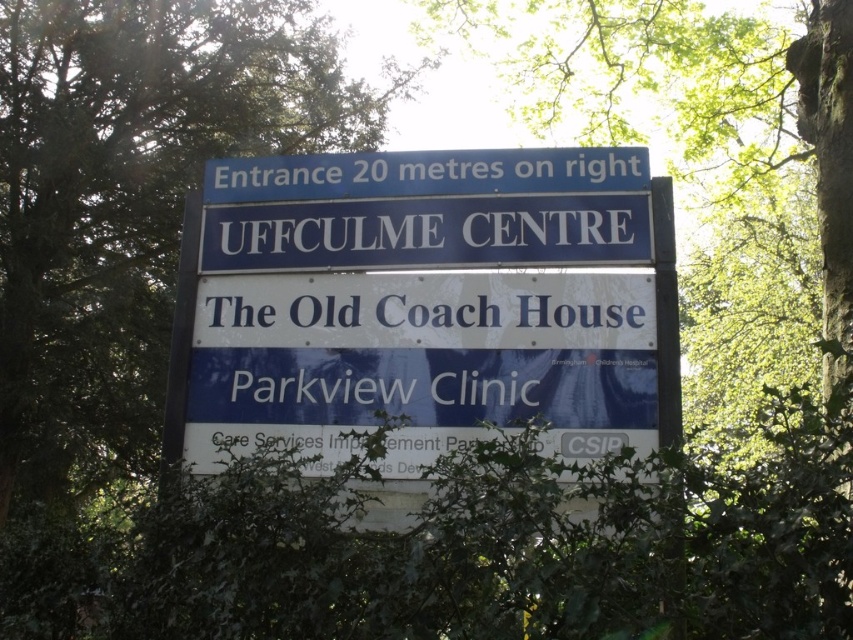
Describe the element at coordinates (424, 304) in the screenshot. I see `blue plastic sign at center` at that location.

This screenshot has height=640, width=853. What are the coordinates of `blue plastic sign at center` in the screenshot? It's located at [424, 304].

Does blue plastic sign at center come in front of white painted signboard at center?

Yes.

Measure the distance between blue plastic sign at center and camera.

They are 9.66 meters apart.

The image size is (853, 640). I want to click on blue plastic sign at center, so click(x=424, y=304).

Which is above, blue metallic sign at upper center or white painted signboard at center?

blue metallic sign at upper center

Who is shorter, blue metallic sign at upper center or white painted signboard at center?

Standing shorter between the two is white painted signboard at center.

You are a GUI agent. You are given a task and a screenshot of the screen. Output one action in this format:
    pyautogui.click(x=<x>, y=<y>)
    Task: Click on the blue metallic sign at upper center
    
    Given the screenshot: What is the action you would take?
    pyautogui.click(x=425, y=173)

Locate an element on the screen. The width and height of the screenshot is (853, 640). blue metallic sign at upper center is located at coordinates (425, 173).